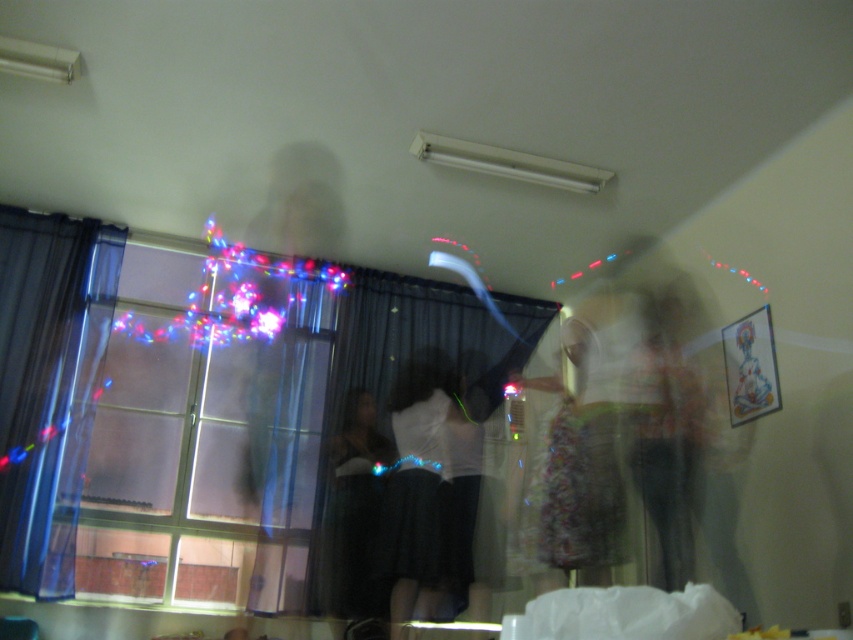
You are standing in the center of the room and want to exit through the translucent glass window at left. Based on its position, in which general direction should you walk to reach it?

The translucent glass window at left is located at point 0.669 on the x axis and 0.242 on the y axis. Since you are at the center, you should walk towards the left direction to reach it.

You are at a party and want to find the matte white blouse at center. Which direction should you look relative to the translucent glass window at left?

The matte white blouse at center is to the right of the translucent glass window at left, so you should look to the right of the window.

You are at the point labeled point (380, 534) and want to move to the door located at point (227, 589). Can you walk directly to it without passing through any obstacles?

Point (227, 589) is behind point (380, 534), so you cannot walk directly to it without passing through the point (380, 534) first.